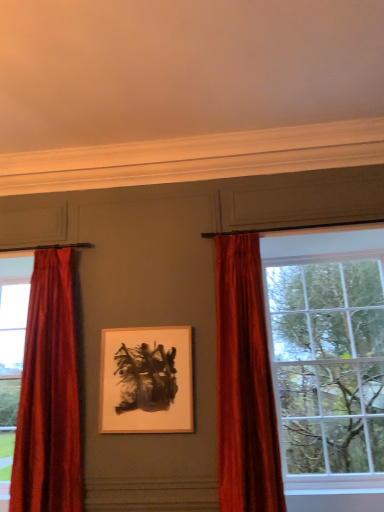
Question: From the image's perspective, is matte glass window at right above or below velvet red curtain at right, placed as the 2th curtain when sorted from left to right?

Choices:
 (A) above
 (B) below

Answer: (B)

Question: Based on their sizes in the image, would you say matte glass window at right is bigger or smaller than velvet red curtain at right, placed as the 2th curtain when sorted from left to right?

Choices:
 (A) small
 (B) big

Answer: (B)

Question: Which of these objects is positioned farthest from the matte white picture frame at center?

Choices:
 (A) velvet red curtain at left, arranged as the second curtain when viewed from the right
 (B) velvet red curtain at right, which is the first curtain in right-to-left order
 (C) matte glass window at right

Answer: (C)

Question: Estimate the real-world distances between objects in this image. Which object is farther from the matte glass window at right?

Choices:
 (A) matte white picture frame at center
 (B) velvet red curtain at left, which is the 1th curtain from left to right
 (C) velvet red curtain at right, which is the first curtain in right-to-left order

Answer: (B)